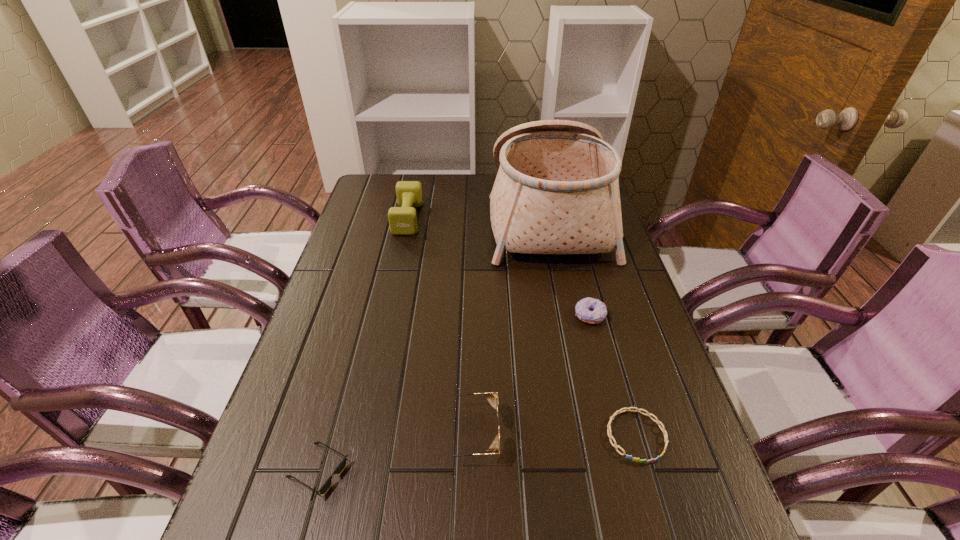
You are a GUI agent. You are given a task and a screenshot of the screen. Output one action in this format:
    pyautogui.click(x=<x>, y=<y>)
    Task: Click on the free region located with the lid open on the tallest object
    Image resolution: width=960 pixels, height=540 pixels.
    Given the screenshot: What is the action you would take?
    pyautogui.click(x=412, y=215)

Locate an element on the screen. Image resolution: width=960 pixels, height=540 pixels. free space located with the lid open on the tallest object is located at coordinates (451, 215).

This screenshot has height=540, width=960. What are the coordinates of `vacant space located 0.090m on the right of the dumbbell` in the screenshot? It's located at (447, 218).

Where is `vacant region located on the front lenses of the taller sunglasses`? The image size is (960, 540). vacant region located on the front lenses of the taller sunglasses is located at coordinates (553, 433).

In order to click on free space located on the left of the doughnut in this screenshot , I will do 422,315.

Where is `vacant space located on the lenses of the shorter sunglasses`? This screenshot has width=960, height=540. vacant space located on the lenses of the shorter sunglasses is located at coordinates (492, 470).

Where is `vacant region located 0.080m on the surface of the shortest object showing star-shaped elements`? This screenshot has height=540, width=960. vacant region located 0.080m on the surface of the shortest object showing star-shaped elements is located at coordinates (658, 508).

Where is `basket that is at the far edge`? Image resolution: width=960 pixels, height=540 pixels. basket that is at the far edge is located at coordinates (557, 190).

I want to click on dumbbell that is positioned at the far edge, so click(x=402, y=220).

I want to click on dumbbell located at the left edge, so click(x=402, y=220).